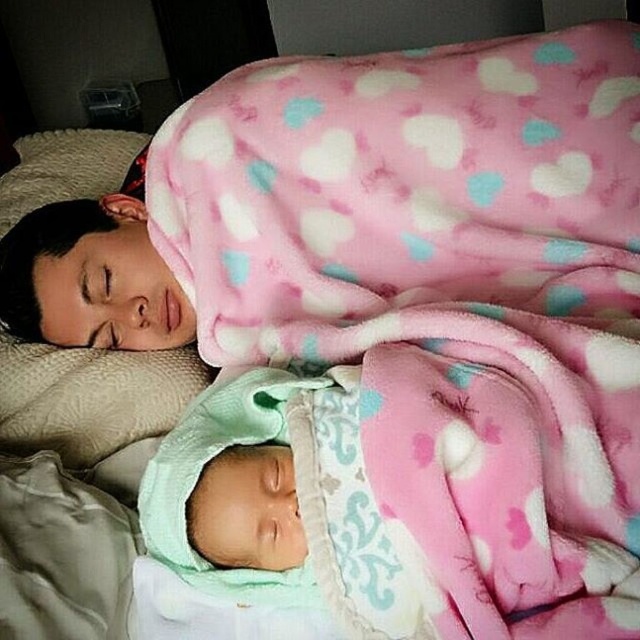
Question: Is green fleece baby at lower center wider than beige quilted pillow at upper left?

Choices:
 (A) yes
 (B) no

Answer: (B)

Question: Is green fleece baby at lower center to the right of beige quilted pillow at upper left from the viewer's perspective?

Choices:
 (A) yes
 (B) no

Answer: (A)

Question: Can you confirm if green fleece baby at lower center is wider than beige quilted pillow at upper left?

Choices:
 (A) yes
 (B) no

Answer: (B)

Question: Among these points, which one is farthest from the camera?

Choices:
 (A) (72, 141)
 (B) (168, 520)

Answer: (A)